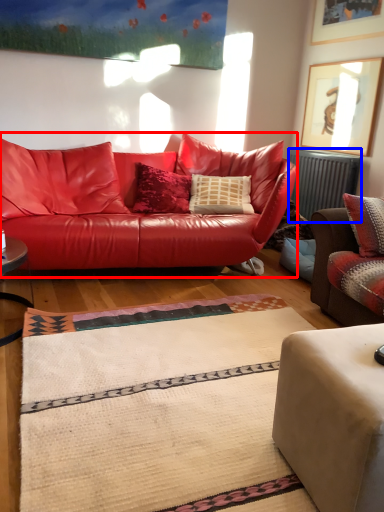
Question: Which point is further to the camera, studio couch (highlighted by a red box) or radiator (highlighted by a blue box)?

Choices:
 (A) studio couch
 (B) radiator

Answer: (B)